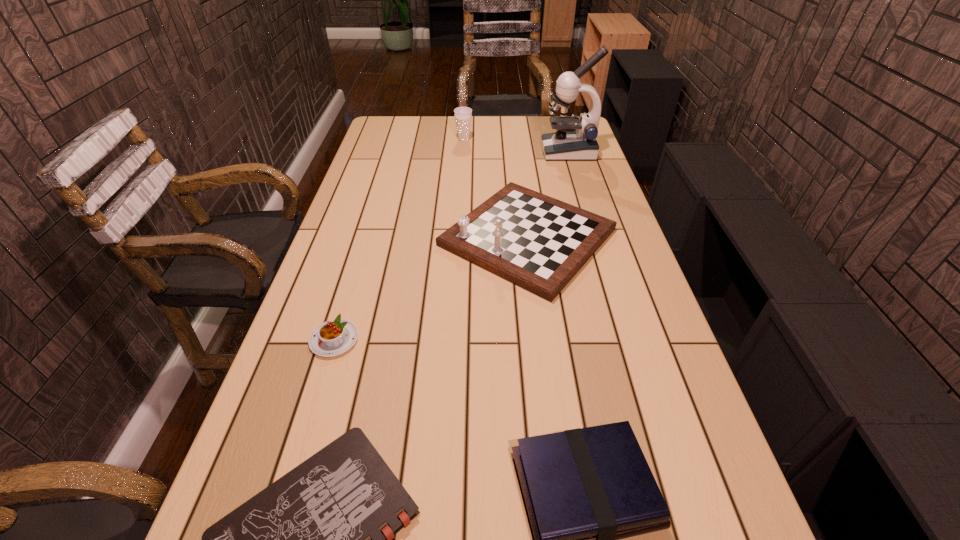
Where is `the tallest object`? This screenshot has width=960, height=540. the tallest object is located at coordinates (575, 139).

You are a GUI agent. You are given a task and a screenshot of the screen. Output one action in this format:
    pyautogui.click(x=<x>, y=<y>)
    Task: Click on the third farthest object
    
    Given the screenshot: What is the action you would take?
    pyautogui.click(x=539, y=243)

This screenshot has width=960, height=540. In order to click on cup in this screenshot , I will do `click(463, 115)`.

Locate an element on the screen. The height and width of the screenshot is (540, 960). the fourth farthest object is located at coordinates (334, 337).

Identify the location of the second shortest object. This screenshot has height=540, width=960. (334, 337).

Locate an element on the screen. This screenshot has height=540, width=960. vacant space located 0.060m on the left of the tallest object is located at coordinates (528, 152).

Locate an element on the screen. This screenshot has width=960, height=540. vacant region located on the front of the gameboard is located at coordinates (551, 421).

I want to click on vacant point located 0.110m on the right of the cup, so click(498, 140).

Image resolution: width=960 pixels, height=540 pixels. In order to click on vacant position located on the front of the pudding in this screenshot , I will do `click(312, 414)`.

The width and height of the screenshot is (960, 540). I want to click on object at the far edge, so pos(463,115).